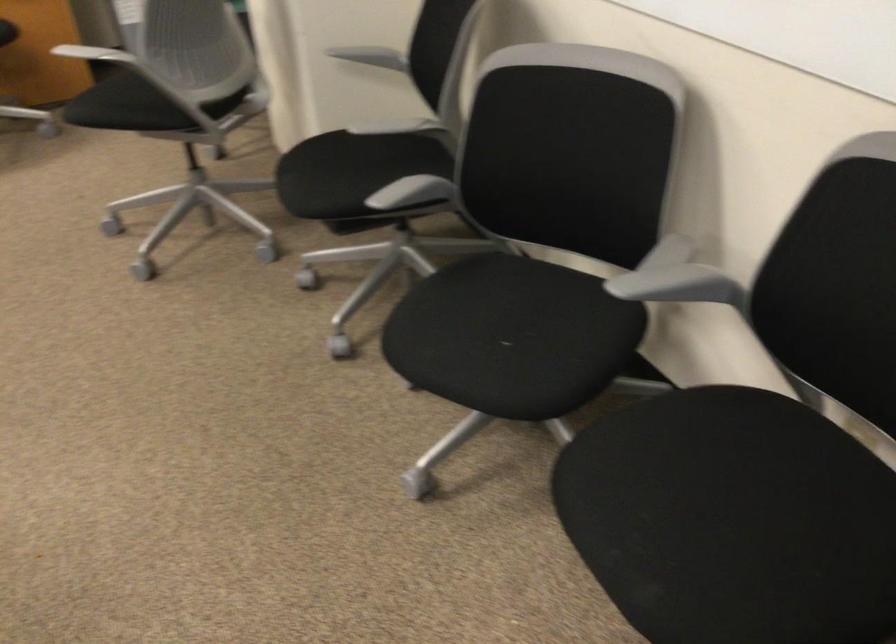
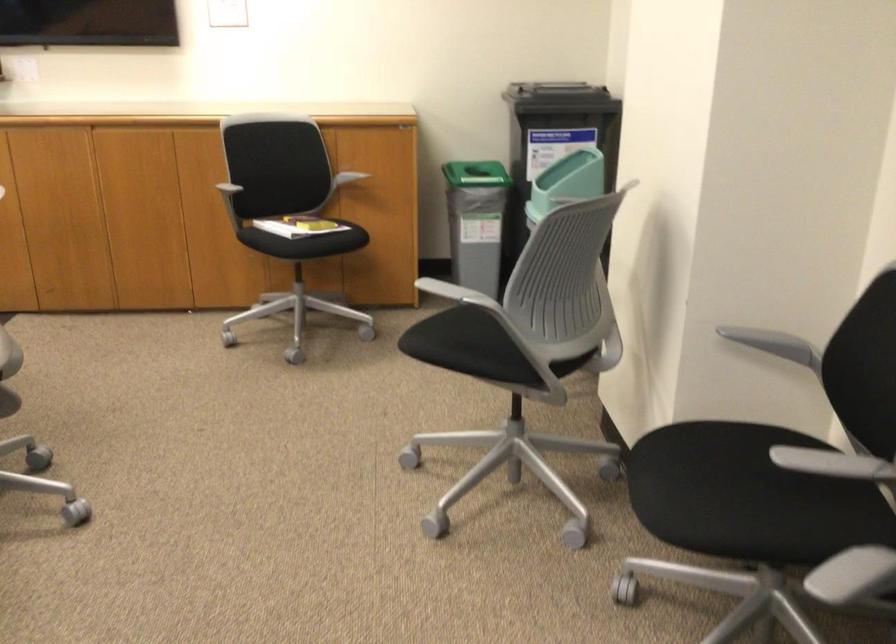
Question: The first image is from the beginning of the video and the second image is from the end. How did the camera likely rotate when shooting the video?

Choices:
 (A) Left
 (B) Right
 (C) Up
 (D) Down

Answer: (A)